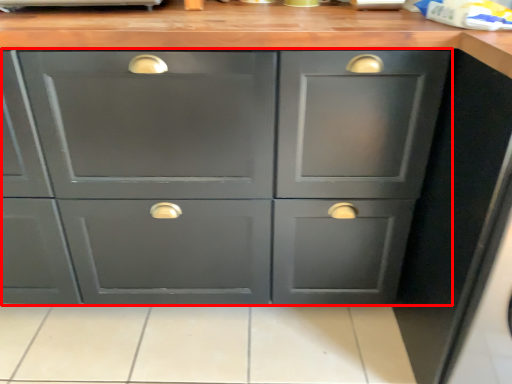
Question: From the image's perspective, where is cabinetry (annotated by the red box) located relative to tile?

Choices:
 (A) above
 (B) below

Answer: (A)